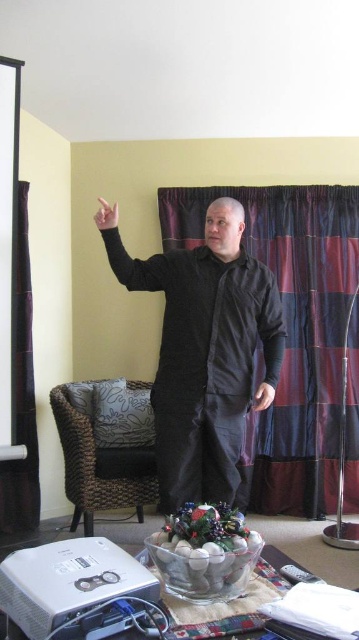
Question: Is plaid fabric curtain at center above velvet curtain at left?

Choices:
 (A) yes
 (B) no

Answer: (A)

Question: Is black matte shirt at upper center above matte black hand at upper left?

Choices:
 (A) no
 (B) yes

Answer: (A)

Question: Among these objects, which one is farthest from the camera?

Choices:
 (A) black matte arm at upper left
 (B) velvet curtain at left
 (C) matte black hand at upper left

Answer: (B)

Question: Does woven rattan armchair at lower left appear under velvet curtain at left?

Choices:
 (A) no
 (B) yes

Answer: (B)

Question: Which is farther from the black cotton robe at center?

Choices:
 (A) velvet curtain at left
 (B) black matte arm at upper left

Answer: (A)

Question: Which object is closer to the camera taking this photo?

Choices:
 (A) black matte arm at upper left
 (B) black cotton robe at center

Answer: (A)